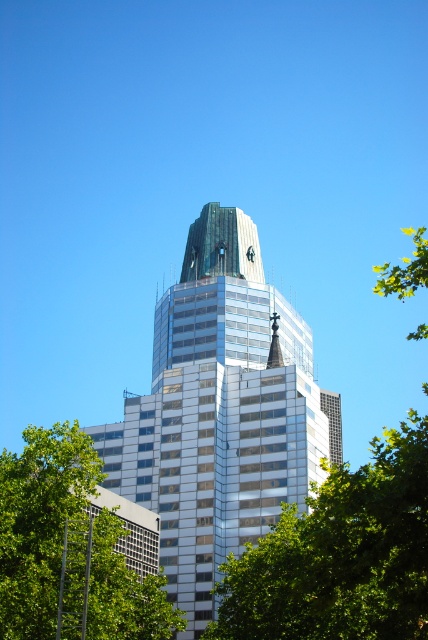
You are an architect analyzing the image of a modern skyscraper. You notice the metallic glass tower at center and the green leafy tree at lower left. Which object occupies more space in the image?

The metallic glass tower at center is larger in size than the green leafy tree at lower left, so it occupies more space in the image.

You are standing at the center of the city square, which is located at point coordinates of 0.5, 0.5. You want to take a photo of the metallic glass tower at center. In which direction should you move to get the best view of the tower?

Since the metallic glass tower at center is located at point coordinates of (x=219, y=412), you should move northeast to align yourself for the best view.